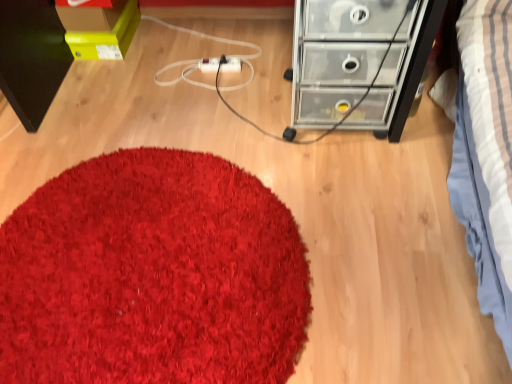
Question: In terms of height, does transparent plastic chest of drawers at upper right look taller or shorter compared to white plastic extension cord at center?

Choices:
 (A) tall
 (B) short

Answer: (A)

Question: From the image's perspective, is transparent plastic chest of drawers at upper right located above or below white plastic extension cord at center?

Choices:
 (A) below
 (B) above

Answer: (A)

Question: Which is nearer to the white plastic extension cord at center?

Choices:
 (A) shaggy red carpet at center
 (B) transparent plastic chest of drawers at upper right

Answer: (B)

Question: Estimate the real-world distances between objects in this image. Which object is closer to the white plastic extension cord at center?

Choices:
 (A) transparent plastic chest of drawers at upper right
 (B) shaggy red carpet at center

Answer: (A)